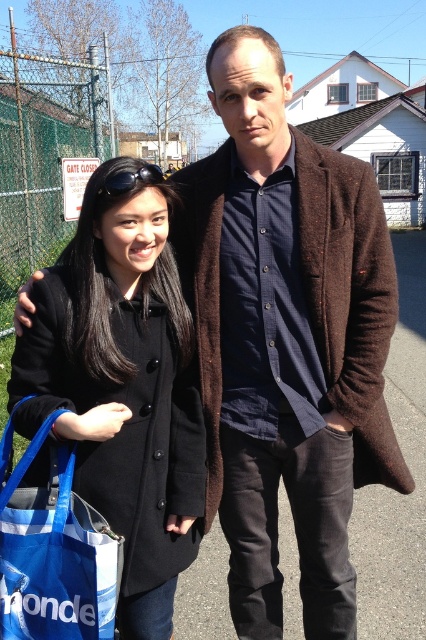
In the scene shown: Based on the scene description, where is the black wool coat at left in relation to the blue fabric bag at lower left?

The black wool coat at left is to the right of the blue fabric bag at lower left.

You are a photographer trying to capture a photo of the blue fabric bag at lower left. The black wool coat at left is blocking your view. Can you move the coat to the side to get a clear shot?

The black wool coat at left is located above the blue fabric bag at lower left, so moving the coat upwards would allow you to see the bag below.

You are a photographer trying to capture a clear shot of the black wool coat at left and the blue fabric bag at lower left. Which object should you focus on first to ensure both are in focus?

The black wool coat at left is closer to the viewer than the blue fabric bag at lower left, so focus on the black wool coat at left first to ensure both are in focus.